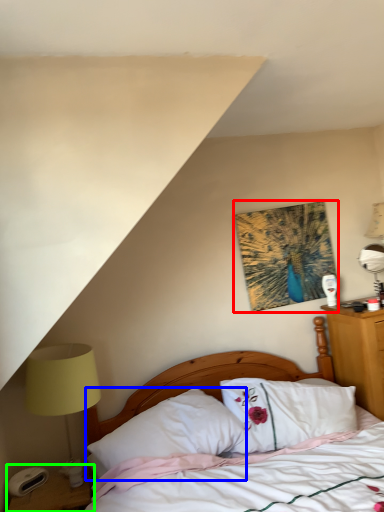
Question: Estimate the real-world distances between objects in this image. Which object is closer to picture frame (highlighted by a red box), pillow (highlighted by a blue box) or nightstand (highlighted by a green box)?

Choices:
 (A) pillow
 (B) nightstand

Answer: (A)